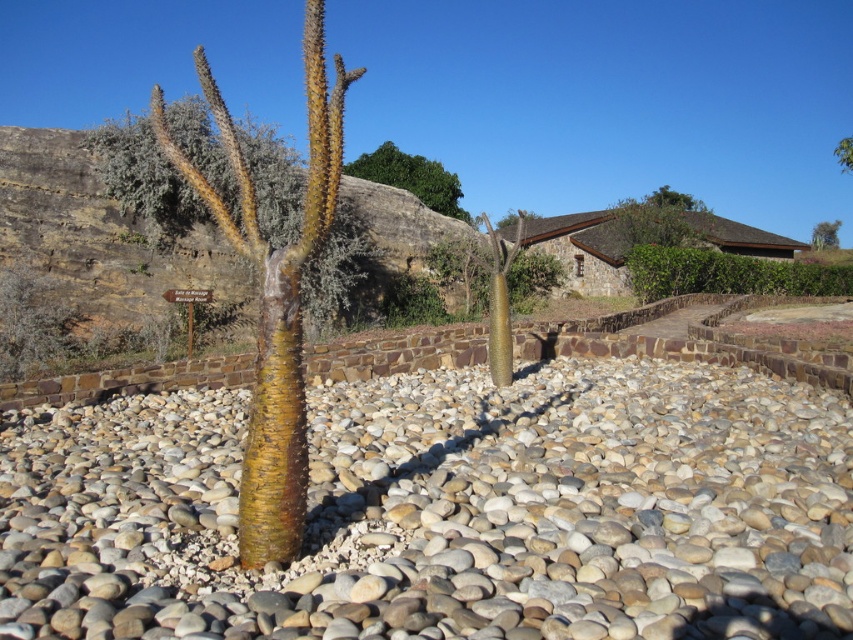
Question: Which of the following is the closest to the observer?

Choices:
 (A) brown textured cactus at center
 (B) green leafy hedge at center
 (C) green leafy tree at upper center

Answer: (A)

Question: Which object is the farthest from the green textured tree at upper right?

Choices:
 (A) green leafy hedge at center
 (B) smooth pebbles at center

Answer: (B)

Question: Can you confirm if brown textured cactus at center is smaller than green textured tree at upper right?

Choices:
 (A) yes
 (B) no

Answer: (B)

Question: Does green leafy hedge at center have a greater width compared to green textured tree at upper right?

Choices:
 (A) yes
 (B) no

Answer: (A)

Question: Does smooth pebbles at center appear on the right side of green textured tree at upper right?

Choices:
 (A) yes
 (B) no

Answer: (B)

Question: Which point is closer to the camera taking this photo?

Choices:
 (A) (628, 577)
 (B) (6, 218)
 (C) (287, 152)
 (D) (844, 161)

Answer: (A)